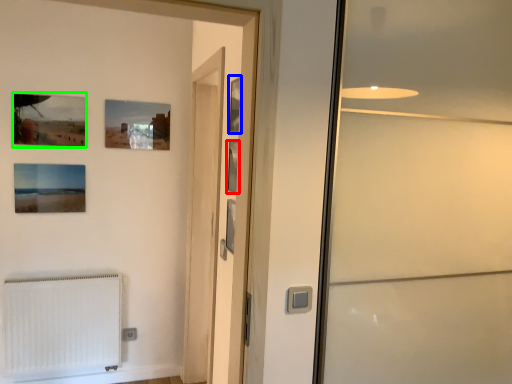
Question: Which is nearer to the picture frame (highlighted by a red box)? picture frame (highlighted by a blue box) or picture frame (highlighted by a green box).

Choices:
 (A) picture frame
 (B) picture frame

Answer: (A)